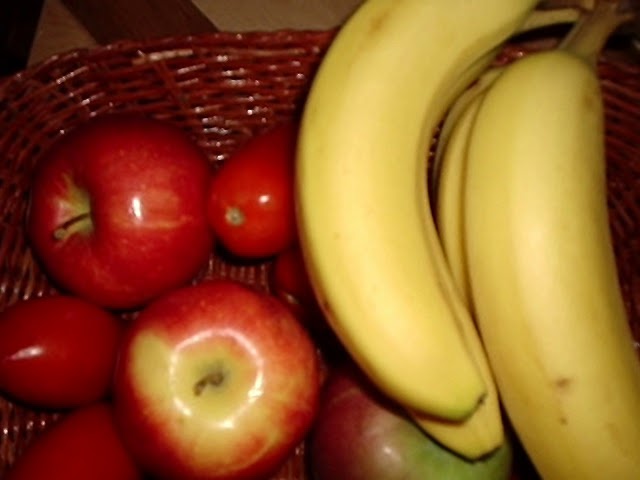
This screenshot has height=480, width=640. What are the coordinates of `basket` in the screenshot? It's located at (234, 76).